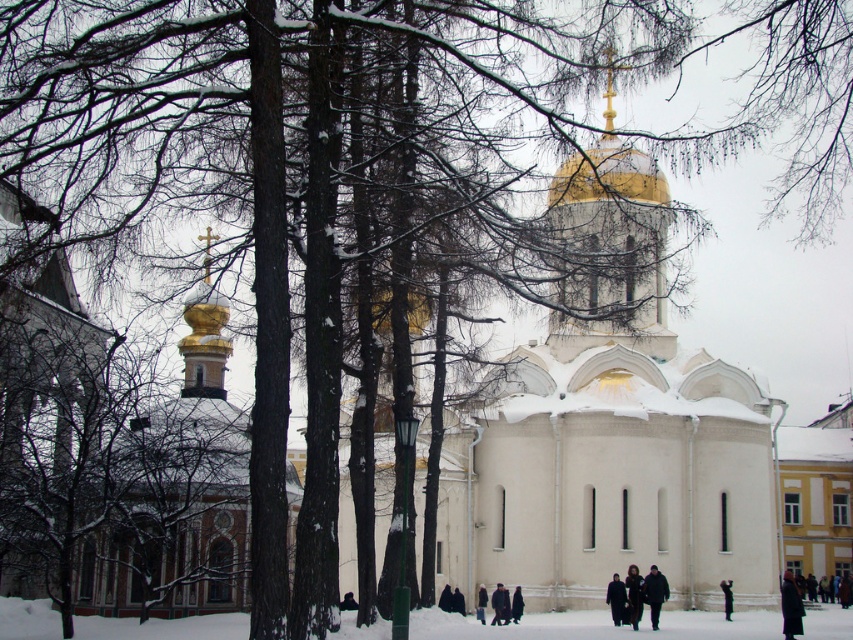
Question: Which of the following is the farthest from the observer?

Choices:
 (A) (653, 253)
 (B) (509, 616)

Answer: (A)

Question: Which point is farther from the camera taking this photo?

Choices:
 (A) (477, 600)
 (B) (604, 269)
 (C) (515, 588)

Answer: (A)

Question: Does dark gray fabric coat at lower center have a larger size compared to black fur coat at lower center?

Choices:
 (A) no
 (B) yes

Answer: (A)

Question: Is gold polished dome at upper center further to the viewer compared to dark brown coat at lower center?

Choices:
 (A) yes
 (B) no

Answer: (B)

Question: Is dark wool coat at center to the left of dark blue coat at center from the viewer's perspective?

Choices:
 (A) no
 (B) yes

Answer: (A)

Question: Which object is positioned farthest from the gold polished dome at upper center?

Choices:
 (A) dark gray fabric coat at lower center
 (B) dark wool coat at lower right
 (C) dark brown fur coat at lower center

Answer: (C)